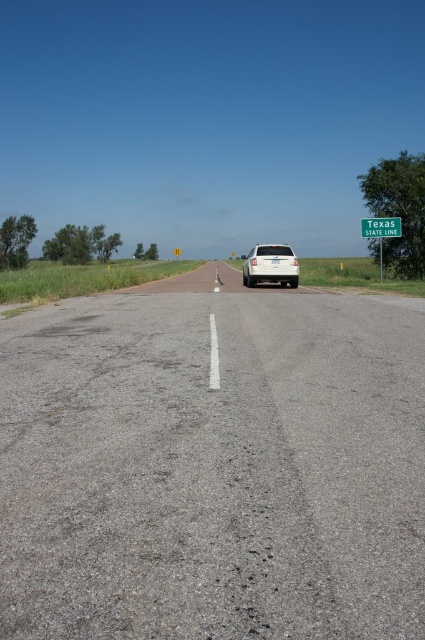
Question: Does green plastic sign at upper right come behind green metallic sign at upper right?

Choices:
 (A) yes
 (B) no

Answer: (A)

Question: Which point is farther to the camera?

Choices:
 (A) green metallic sign at upper right
 (B) green plastic sign at upper right
 (C) gray asphalt road at center
 (D) white matte car at center

Answer: (B)

Question: Which of these objects is positioned closest to the green metallic sign at upper right?

Choices:
 (A) white matte car at center
 (B) green plastic sign at upper right
 (C) gray asphalt road at center

Answer: (B)

Question: Which object is positioned farthest from the green plastic sign at upper right?

Choices:
 (A) white matte car at center
 (B) gray asphalt road at center
 (C) green metallic sign at upper right

Answer: (A)

Question: Is gray asphalt road at center thinner than green metallic sign at upper right?

Choices:
 (A) yes
 (B) no

Answer: (A)

Question: Where is white matte car at center located in relation to green metallic sign at upper right in the image?

Choices:
 (A) left
 (B) right

Answer: (A)